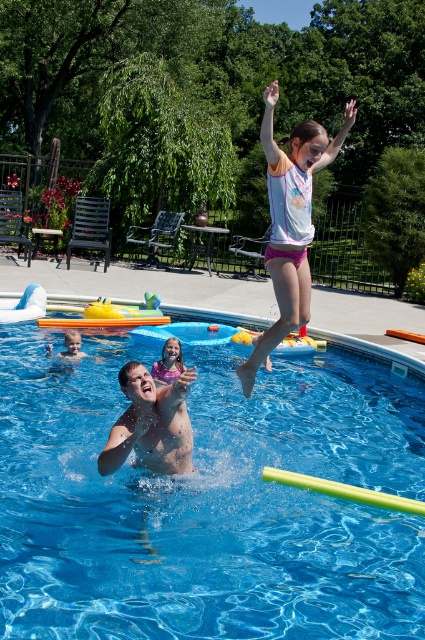
Which is below, blue smooth water at center or smooth tan skin at center?

blue smooth water at center is below.

Can you confirm if blue smooth water at center is smaller than smooth tan skin at center?

No.

The image size is (425, 640). I want to click on blue smooth water at center, so click(x=207, y=500).

Based on the photo, is matte pink shorts at upper center wider than smooth tan skin at center?

No, matte pink shorts at upper center is not wider than smooth tan skin at center.

Between point (170, 372) and point (76, 348), which one is positioned in front?

Positioned in front is point (170, 372).

You are a GUI agent. You are given a task and a screenshot of the screen. Output one action in this format:
    pyautogui.click(x=<x>, y=<y>)
    Task: Click on the matte pink shorts at upper center
    The height and width of the screenshot is (640, 425).
    Given the screenshot: What is the action you would take?
    pyautogui.click(x=169, y=362)

Does pink fabric shorts at upper center appear under smooth skin man at center?

Incorrect, pink fabric shorts at upper center is not positioned below smooth skin man at center.

Does pink fabric shorts at upper center have a lesser width compared to smooth skin man at center?

Correct, pink fabric shorts at upper center's width is less than smooth skin man at center's.

Is point (283, 317) in front of point (118, 458)?

No, it is not.

Where is `pink fabric shorts at upper center`? The image size is (425, 640). pink fabric shorts at upper center is located at coordinates (289, 224).